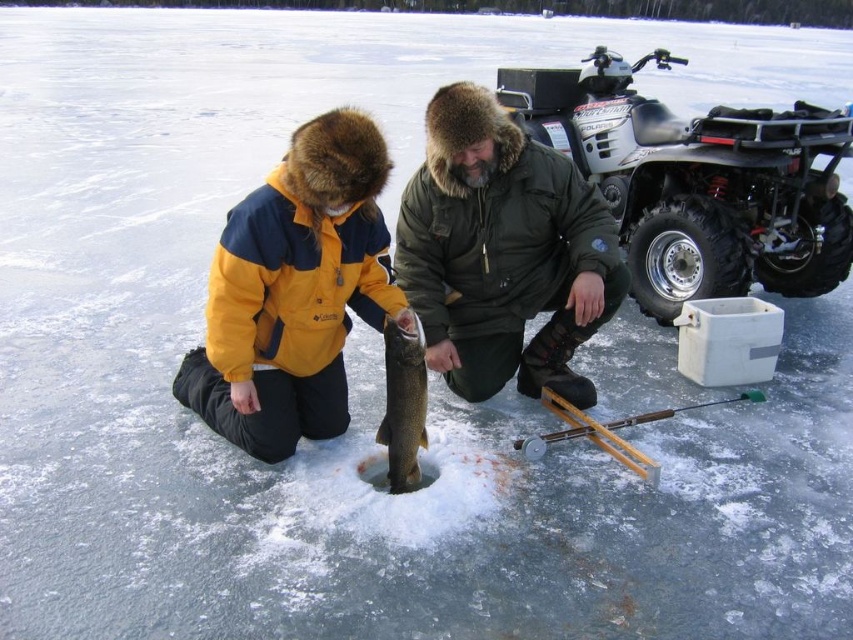
You are an observer standing at the edge of the frozen lake. You see the green matte jacket at center and the wooden fishing pole at lower center. Which object is taller?

The green matte jacket at center is taller than the wooden fishing pole at lower center.